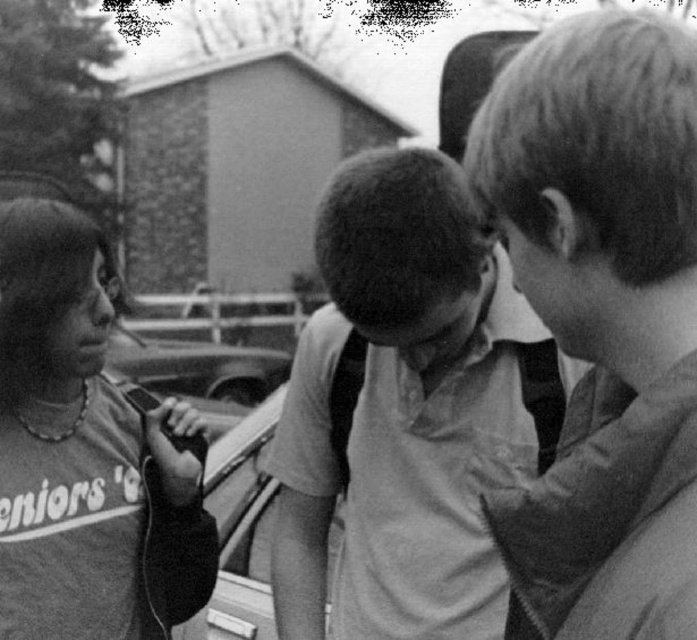
Question: Which object is closer to the camera taking this photo?

Choices:
 (A) smooth brown hair at upper right
 (B) matte gray sweatshirt at left
 (C) smooth white shirt at center

Answer: (A)

Question: Can you confirm if smooth brown hair at upper right is positioned to the right of matte gray sweatshirt at left?

Choices:
 (A) no
 (B) yes

Answer: (B)

Question: Which object is closer to the camera taking this photo?

Choices:
 (A) matte gray sweatshirt at left
 (B) smooth brown hair at upper right
 (C) smooth white shirt at center

Answer: (B)

Question: Can you confirm if smooth brown hair at upper right is positioned to the left of smooth white shirt at center?

Choices:
 (A) no
 (B) yes

Answer: (A)

Question: Does smooth brown hair at upper right have a lesser width compared to smooth white shirt at center?

Choices:
 (A) yes
 (B) no

Answer: (A)

Question: Which object is closer to the camera taking this photo?

Choices:
 (A) smooth brown hair at upper right
 (B) matte gray sweatshirt at left
 (C) smooth white shirt at center

Answer: (A)